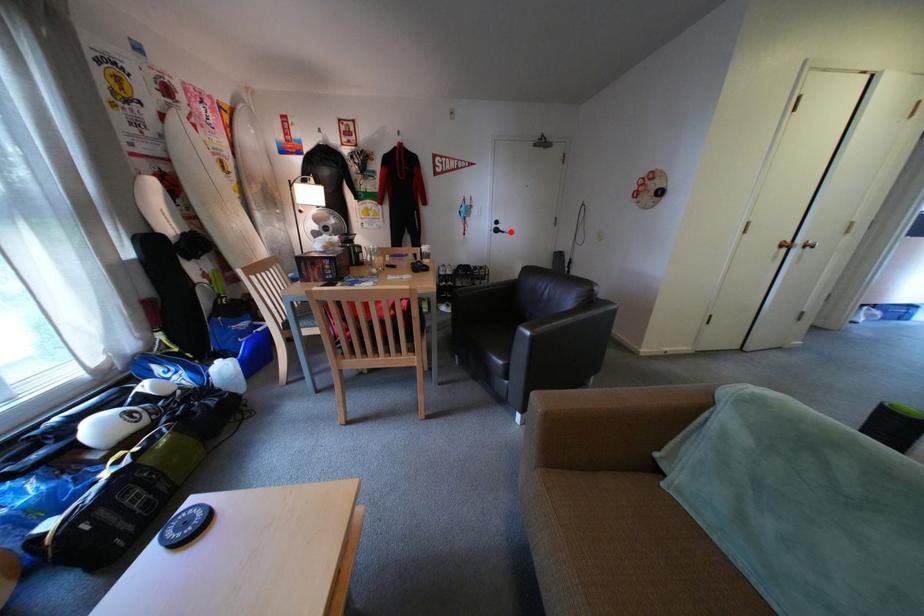
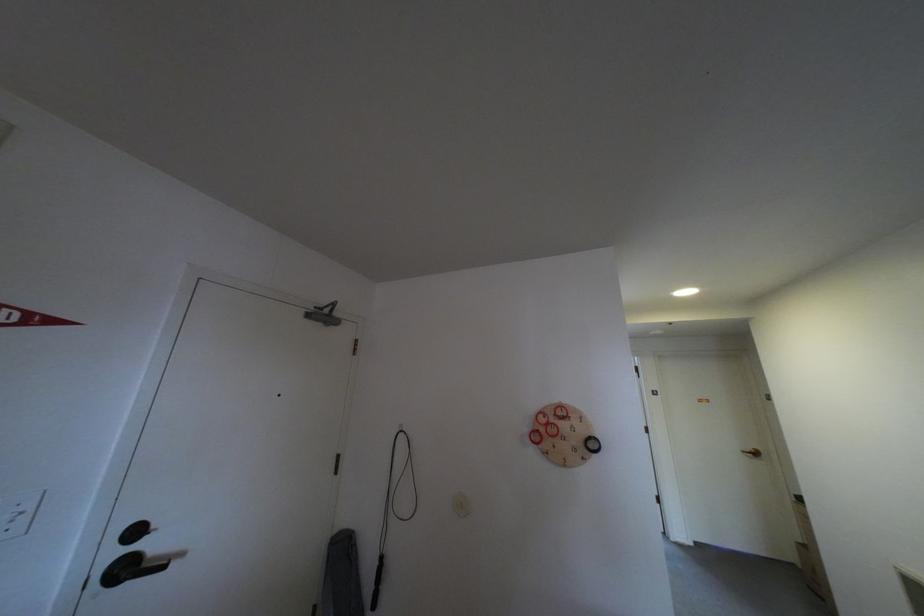
The point at the highlighted location is marked in the first image. Where is the corresponding point in the second image?

(140, 570)